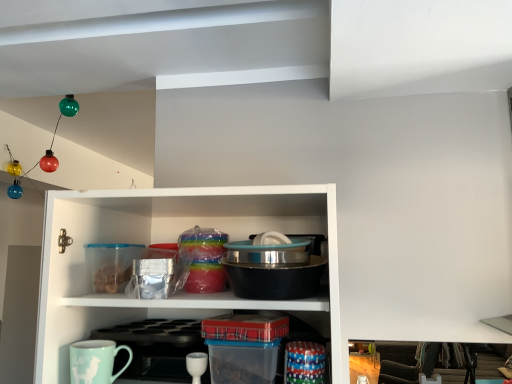
Question: Is white glossy cup at lower center in front of or behind teal glossy mug at lower left in the image?

Choices:
 (A) front
 (B) behind

Answer: (B)

Question: Is white glossy cup at lower center inside the boundaries of teal glossy mug at lower left, or outside?

Choices:
 (A) outside
 (B) inside

Answer: (A)

Question: Which object is the closest to the teal glossy mug at lower left?

Choices:
 (A) stainless steel bowl at center
 (B) white glossy cup at lower center

Answer: (B)

Question: Estimate the real-world distances between objects in this image. Which object is closer to the teal glossy mug at lower left?

Choices:
 (A) white glossy cup at lower center
 (B) stainless steel bowl at center

Answer: (A)